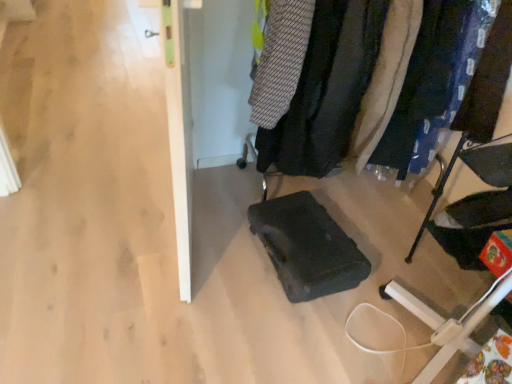
Question: From a real-world perspective, does white textured fabric at center right, the 3th clothing from the left, stand above blue fabric pants at right, which appears as the fourth clothing when viewed from the left?

Choices:
 (A) no
 (B) yes

Answer: (A)

Question: Can you confirm if white textured fabric at center right, the 3th clothing from the left, is shorter than blue fabric pants at right, which appears as the fourth clothing when viewed from the left?

Choices:
 (A) no
 (B) yes

Answer: (A)

Question: Can you confirm if white textured fabric at center right, the 3th clothing from the left, is bigger than blue fabric pants at right, which appears as the fourth clothing when viewed from the left?

Choices:
 (A) yes
 (B) no

Answer: (A)

Question: Is white textured fabric at center right, marked as the 2th clothing in a right-to-left arrangement, oriented away from blue fabric pants at right, which appears as the fourth clothing when viewed from the left?

Choices:
 (A) yes
 (B) no

Answer: (B)

Question: Is white textured fabric at center right, marked as the 2th clothing in a right-to-left arrangement, taller than blue fabric pants at right, which appears as the fourth clothing when viewed from the left?

Choices:
 (A) yes
 (B) no

Answer: (A)

Question: From the image's perspective, is white textured fabric at center right, marked as the 2th clothing in a right-to-left arrangement, above or below velvet black coat at center?

Choices:
 (A) above
 (B) below

Answer: (A)

Question: Considering the positions of white textured fabric at center right, marked as the 2th clothing in a right-to-left arrangement, and velvet black coat at center in the image, is white textured fabric at center right, marked as the 2th clothing in a right-to-left arrangement, wider or thinner than velvet black coat at center?

Choices:
 (A) thin
 (B) wide

Answer: (B)

Question: From a real-world perspective, is white textured fabric at center right, the 3th clothing from the left, above or below velvet black coat at center?

Choices:
 (A) below
 (B) above

Answer: (B)

Question: Is point (373, 117) positioned closer to the camera than point (454, 29)?

Choices:
 (A) farther
 (B) closer

Answer: (A)

Question: Looking at their shapes, would you say white textured fabric at center right, marked as the 2th clothing in a right-to-left arrangement, is wider or thinner than black fabric chair at lower right?

Choices:
 (A) thin
 (B) wide

Answer: (B)

Question: In the image, is white textured fabric at center right, the 3th clothing from the left, positioned in front of or behind black fabric chair at lower right?

Choices:
 (A) front
 (B) behind

Answer: (B)

Question: Would you say white textured fabric at center right, the 3th clothing from the left, is to the left or to the right of black fabric chair at lower right in the picture?

Choices:
 (A) right
 (B) left

Answer: (B)

Question: Is white textured fabric at center right, the 3th clothing from the left, taller or shorter than black fabric chair at lower right?

Choices:
 (A) tall
 (B) short

Answer: (A)

Question: From the image's perspective, is blue fabric pants at right, which is the first clothing in right-to-left order, located above or below black fabric chair at lower right?

Choices:
 (A) below
 (B) above

Answer: (B)

Question: Is point (415, 129) closer or farther from the camera than point (500, 137)?

Choices:
 (A) closer
 (B) farther

Answer: (B)